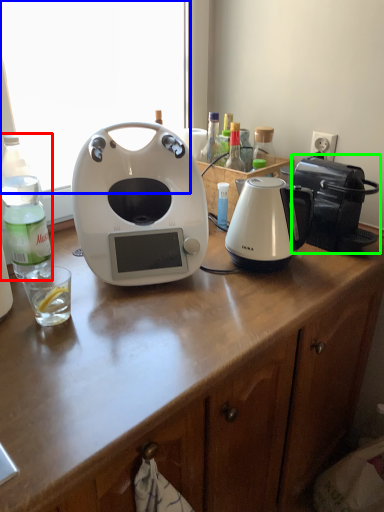
Question: Which object is the farthest from bottle (highlighted by a red box)? Choose among these: window screen (highlighted by a blue box) or toaster (highlighted by a green box).

Choices:
 (A) window screen
 (B) toaster

Answer: (A)